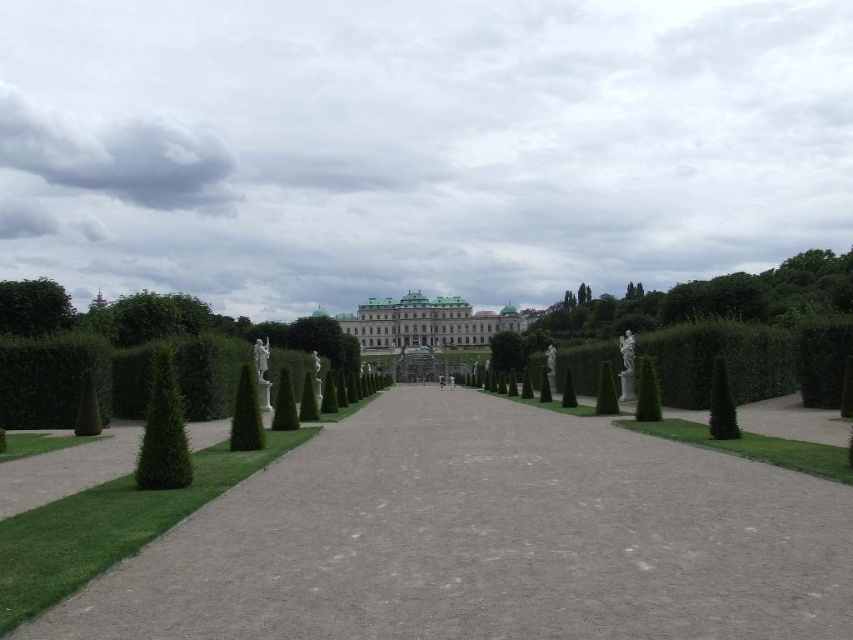
Is point (341, 332) less distant than point (47, 326)?

No, it is behind (47, 326).

Can you confirm if green leafy hedge at left is thinner than green leafy tree at left?

Incorrect, green leafy hedge at left's width is not less than green leafy tree at left's.

From the picture: Who is more forward, (86,332) or (47,301)?

Point (86,332) is in front.

Identify the location of green leafy hedge at left. The height and width of the screenshot is (640, 853). (140, 353).

Is green leafy hedge at left to the left of green leafy bush at center from the viewer's perspective?

Yes, green leafy hedge at left is to the left of green leafy bush at center.

Does green leafy hedge at left have a greater height compared to green leafy bush at center?

Yes.

Is point (305, 364) positioned before point (280, 390)?

No, (305, 364) is behind (280, 390).

Find the location of a particular element. Image resolution: width=853 pixels, height=640 pixels. green leafy hedge at left is located at coordinates (140, 353).

Between white stone palace at center and green textured bush at left, which one appears on the left side from the viewer's perspective?

From the viewer's perspective, green textured bush at left appears more on the left side.

Does point (490, 314) lie in front of point (154, 465)?

No, it is not.

This screenshot has height=640, width=853. I want to click on white stone palace at center, so click(428, 323).

Find the location of `white stone palace at center`. white stone palace at center is located at coordinates (428, 323).